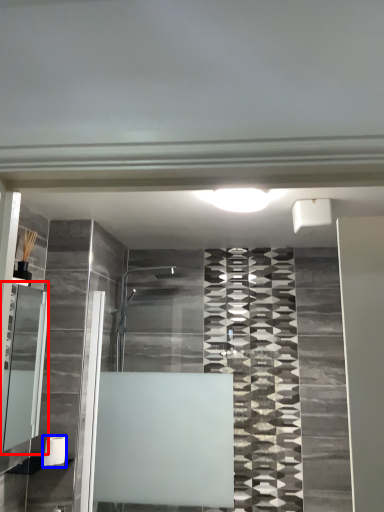
Question: Which point is further to the camera, cabinet (highlighted by a red box) or toilet paper (highlighted by a blue box)?

Choices:
 (A) cabinet
 (B) toilet paper

Answer: (B)